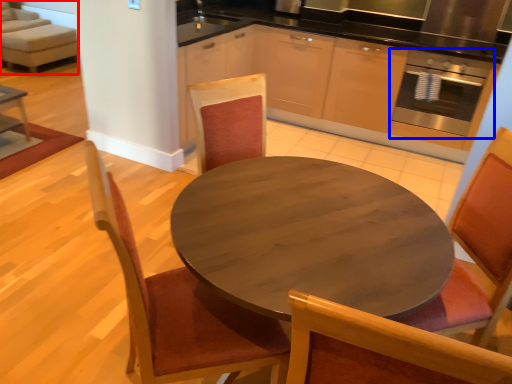
Question: Which object appears closest to the camera in this image, couch (highlighted by a red box) or oven (highlighted by a blue box)?

Choices:
 (A) couch
 (B) oven

Answer: (B)